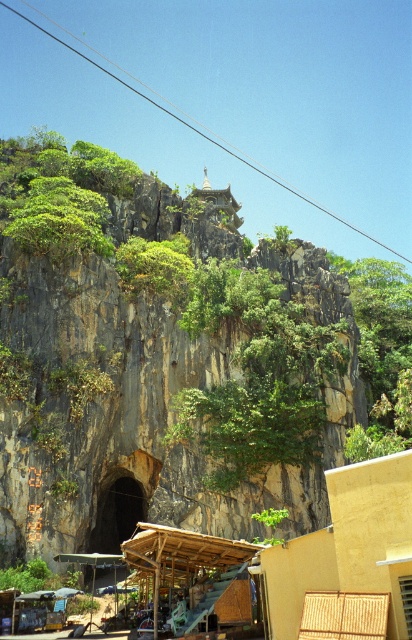
Question: Where is beige wicker hut at lower right located in relation to wooden canopy at lower center in the image?

Choices:
 (A) right
 (B) left

Answer: (A)

Question: Where is beige wicker hut at lower right located in relation to wooden canopy at lower center in the image?

Choices:
 (A) right
 (B) left

Answer: (A)

Question: Which point is farther to the camera?

Choices:
 (A) beige wicker hut at lower right
 (B) wooden canopy at lower center

Answer: (B)

Question: Does beige wicker hut at lower right lie in front of wooden canopy at lower center?

Choices:
 (A) no
 (B) yes

Answer: (B)